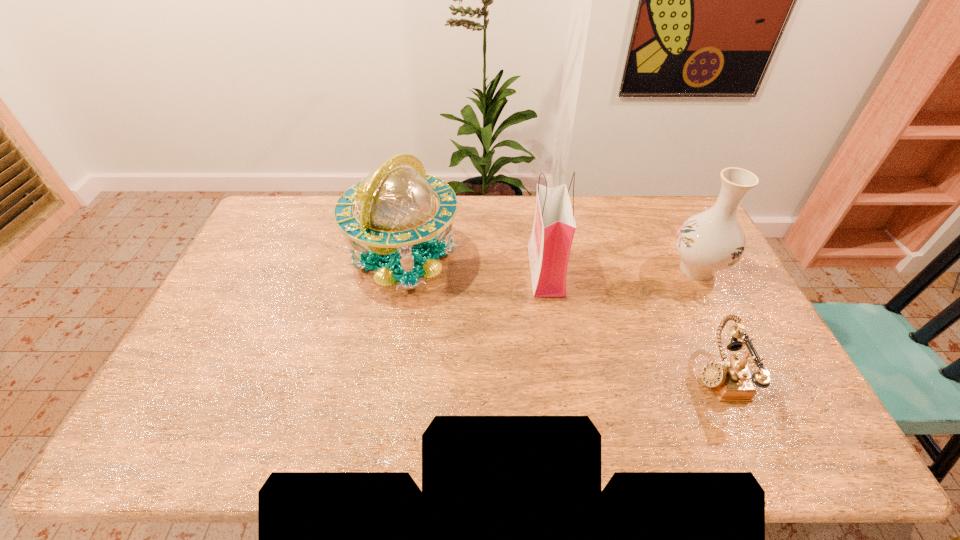
I want to click on vacant space situated 0.170m on the dial number of the shortest object, so click(x=633, y=375).

Identify the location of vacant region located 0.140m on the dial number of the shortest object. The height and width of the screenshot is (540, 960). (644, 375).

Where is `blank space located 0.230m on the dial number of the shortest object`? blank space located 0.230m on the dial number of the shortest object is located at coordinates (611, 375).

Image resolution: width=960 pixels, height=540 pixels. Find the location of `object that is at the far edge`. object that is at the far edge is located at coordinates (396, 206).

At what (x,y) coordinates should I click in order to perform the action: click on vase that is at the right edge. Please return your answer as a coordinate pair (x, y). Looking at the image, I should click on (710, 241).

Where is `telephone at the right edge`? The height and width of the screenshot is (540, 960). telephone at the right edge is located at coordinates (731, 380).

The width and height of the screenshot is (960, 540). In order to click on free point at the far edge in this screenshot , I will do `click(329, 207)`.

Where is `free space at the near edge of the desktop`? This screenshot has height=540, width=960. free space at the near edge of the desktop is located at coordinates (653, 428).

Locate an element on the screen. Image resolution: width=960 pixels, height=540 pixels. vacant space at the left edge of the desktop is located at coordinates (250, 301).

The height and width of the screenshot is (540, 960). Identify the location of free region at the right edge. (763, 333).